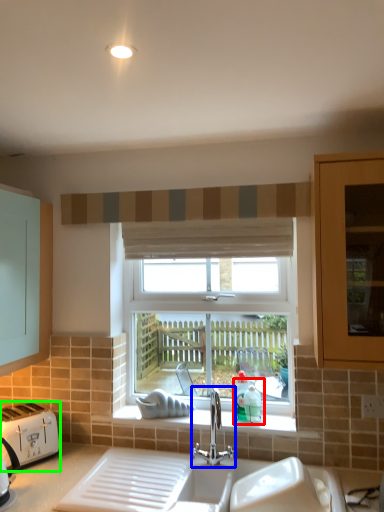
Question: Which object is positioned farthest from teal (highlighted by a red box)? Select from tap (highlighted by a blue box) and toaster (highlighted by a green box).

Choices:
 (A) tap
 (B) toaster

Answer: (B)